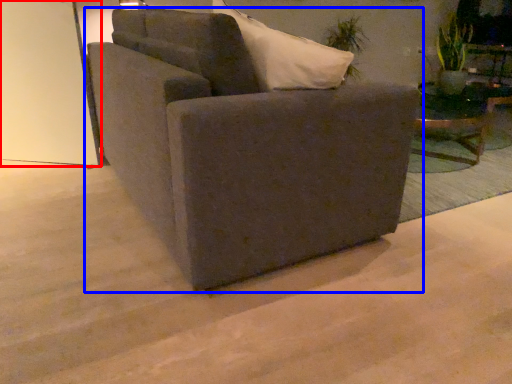
Question: Which point is closer to the camera, glass door (highlighted by a red box) or chair (highlighted by a blue box)?

Choices:
 (A) glass door
 (B) chair

Answer: (B)